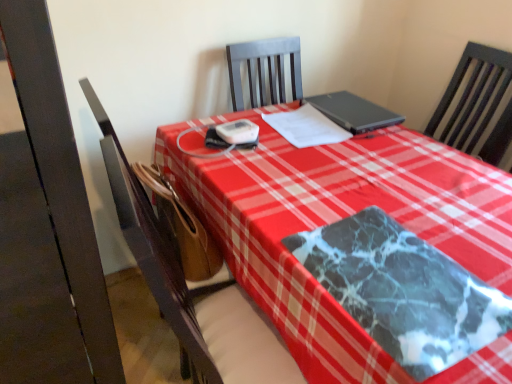
Question: Based on their sizes in the image, would you say black matte laptop at center is bigger or smaller than white paper at center?

Choices:
 (A) big
 (B) small

Answer: (A)

Question: In terms of width, does black matte laptop at center look wider or thinner when compared to white paper at center?

Choices:
 (A) thin
 (B) wide

Answer: (B)

Question: Which of these objects is positioned farthest from the marble-patterned blanket at center?

Choices:
 (A) brown leather chair at center
 (B) white paper at center
 (C) black matte laptop at center

Answer: (C)

Question: Estimate the real-world distances between objects in this image. Which object is farther from the marble-patterned blanket at center?

Choices:
 (A) brown leather chair at center
 (B) black matte laptop at center
 (C) white paper at center

Answer: (B)